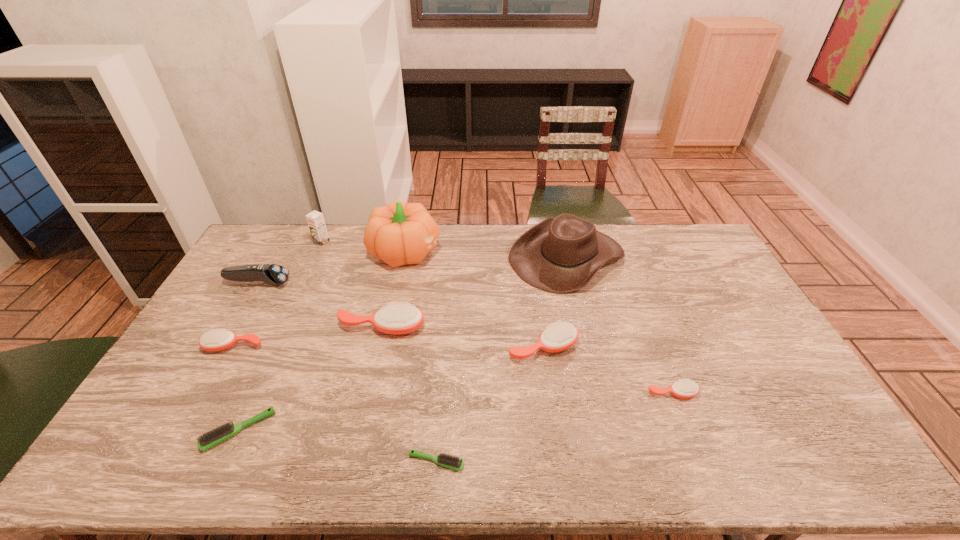
At what (x,y) coordinates should I click in order to perform the action: click on pumpkin. Please return your answer as a coordinate pair (x, y). This screenshot has width=960, height=540. Looking at the image, I should click on (400, 233).

This screenshot has width=960, height=540. I want to click on cowboy hat, so click(x=559, y=255).

Locate an element on the screen. brown chocolate milk is located at coordinates (315, 219).

Identify the location of electric shaver. This screenshot has height=540, width=960. (273, 274).

Find the location of a particular element. This screenshot has height=540, width=960. the biggest orange hairbrush is located at coordinates (397, 318).

Find the location of a particular element. The image size is (960, 540). the third hairbrush from left to right is located at coordinates (397, 318).

Where is `the third orange hairbrush from left to right`? This screenshot has height=540, width=960. the third orange hairbrush from left to right is located at coordinates (x=558, y=337).

The width and height of the screenshot is (960, 540). Find the location of `the second hairbrush from right to left`. the second hairbrush from right to left is located at coordinates (558, 337).

The height and width of the screenshot is (540, 960). I want to click on the third tallest hairbrush, so tap(217, 339).

Locate an element on the screen. This screenshot has height=540, width=960. the second smallest orange hairbrush is located at coordinates (217, 339).